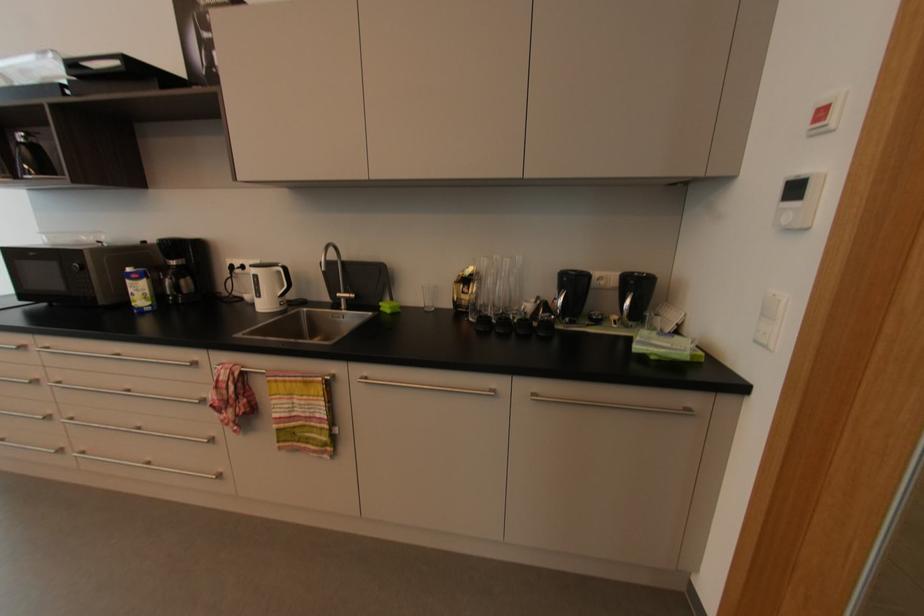
You are a GUI agent. You are given a task and a screenshot of the screen. Output one action in this format:
    pyautogui.click(x=<x>, y=<y>)
    Task: Click on the green sponge
    
    Given the screenshot: What is the action you would take?
    coord(388,307)